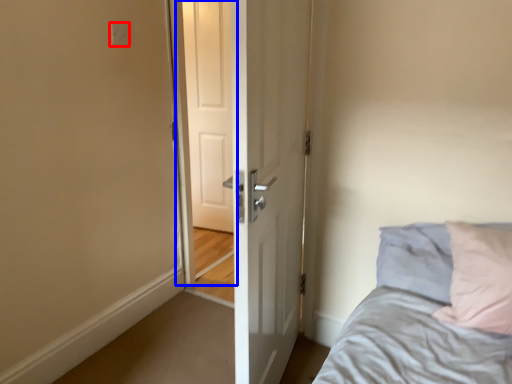
Question: Among these objects, which one is nearest to the camera, electric outlet (highlighted by a red box) or screen door (highlighted by a blue box)?

Choices:
 (A) electric outlet
 (B) screen door

Answer: (A)